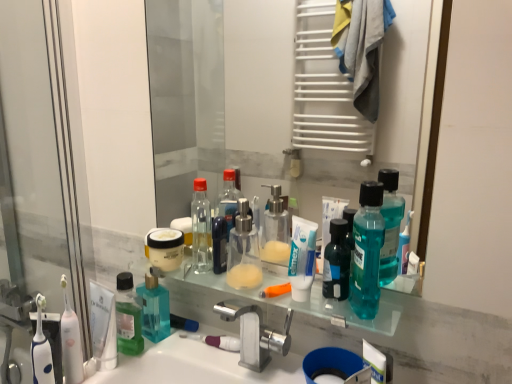
Question: Considering the relative sizes of white glossy sink at lower center and white matte toothpaste at center in the image provided, is white glossy sink at lower center bigger than white matte toothpaste at center?

Choices:
 (A) no
 (B) yes

Answer: (B)

Question: Is white glossy sink at lower center smaller than white matte toothpaste at center?

Choices:
 (A) no
 (B) yes

Answer: (A)

Question: From the image's perspective, does white glossy sink at lower center appear lower than white matte toothpaste at center?

Choices:
 (A) no
 (B) yes

Answer: (B)

Question: Would you say white glossy sink at lower center is outside white matte toothpaste at center?

Choices:
 (A) no
 (B) yes

Answer: (B)

Question: Is white glossy sink at lower center positioned behind white matte toothpaste at center?

Choices:
 (A) yes
 (B) no

Answer: (B)

Question: Would you consider white glossy sink at lower center to be distant from white matte toothpaste at center?

Choices:
 (A) no
 (B) yes

Answer: (A)

Question: Is there a large distance between teal plastic mouthwash at center and transparent glass mirror at center?

Choices:
 (A) no
 (B) yes

Answer: (B)

Question: Does teal plastic mouthwash at center appear on the left side of transparent glass mirror at center?

Choices:
 (A) no
 (B) yes

Answer: (A)

Question: Is teal plastic mouthwash at center taller than transparent glass mirror at center?

Choices:
 (A) no
 (B) yes

Answer: (A)

Question: Considering the relative sizes of teal plastic mouthwash at center and transparent glass mirror at center in the image provided, is teal plastic mouthwash at center bigger than transparent glass mirror at center?

Choices:
 (A) no
 (B) yes

Answer: (A)

Question: Can you confirm if teal plastic mouthwash at center is smaller than transparent glass mirror at center?

Choices:
 (A) yes
 (B) no

Answer: (A)

Question: Is teal plastic mouthwash at center positioned behind transparent glass mirror at center?

Choices:
 (A) yes
 (B) no

Answer: (A)

Question: Does transparent plastic screen door at left appear on the right side of white matte toothpaste at center?

Choices:
 (A) no
 (B) yes

Answer: (A)